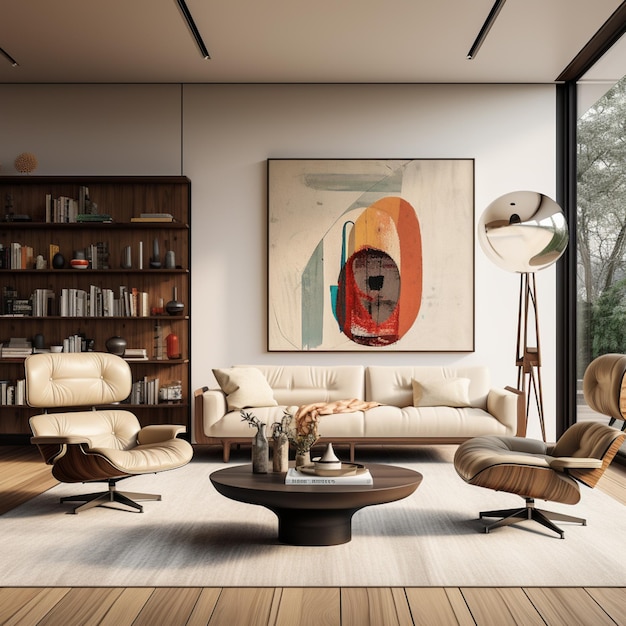
Locate an element on the screen. Image resolution: width=626 pixels, height=626 pixels. shelf is located at coordinates (108, 198), (131, 235), (149, 287), (165, 337), (162, 390).